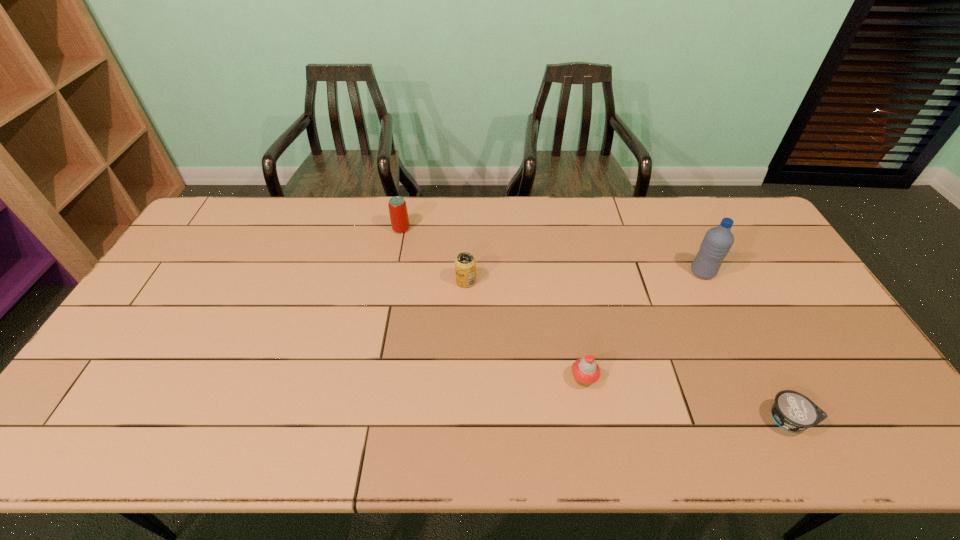
In the image, there is a desktop. What are the coordinates of `vacant space at the near right corner` in the screenshot? It's located at (892, 417).

Where is `vacant area that lies between the left beer can and the water bottle`? The height and width of the screenshot is (540, 960). vacant area that lies between the left beer can and the water bottle is located at coordinates (552, 251).

Where is `free space between the left beer can and the yogurt`? free space between the left beer can and the yogurt is located at coordinates (595, 324).

Identify the location of free space between the fourth farthest object and the farthest object. point(492,303).

Locate an element on the screen. This screenshot has width=960, height=540. free space between the tallest object and the shortest object is located at coordinates (746, 346).

Locate an element on the screen. free space that is in between the farther beer can and the nearest object is located at coordinates pos(595,324).

Where is `unoccupied area between the nearest object and the tallest object`? This screenshot has width=960, height=540. unoccupied area between the nearest object and the tallest object is located at coordinates (746, 346).

You are a GUI agent. You are given a task and a screenshot of the screen. Output one action in this format:
    pyautogui.click(x=<x>, y=<y>)
    Task: Click on the vacant area that lies between the tallest object and the second nearest object
    The image size is (960, 540).
    Given the screenshot: What is the action you would take?
    pyautogui.click(x=643, y=326)

I want to click on vacant area that lies between the fourth object from right to left and the third object from right to left, so click(525, 330).

Locate an element on the screen. The image size is (960, 540). free spot between the right beer can and the water bottle is located at coordinates (585, 277).